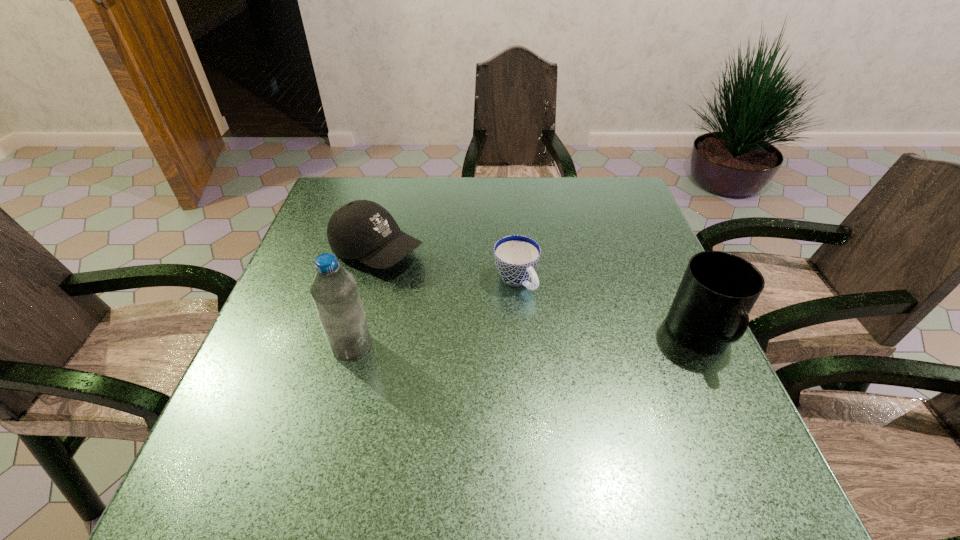
The height and width of the screenshot is (540, 960). I want to click on free location at the right edge, so click(x=671, y=281).

Identify the location of vacant space at the far right corner of the desktop. This screenshot has height=540, width=960. point(590,198).

Image resolution: width=960 pixels, height=540 pixels. I want to click on vacant region at the near right corner of the desktop, so click(x=735, y=421).

Where is `empty space that is in between the third shortest object and the third object from left to right`? Image resolution: width=960 pixels, height=540 pixels. empty space that is in between the third shortest object and the third object from left to right is located at coordinates (609, 308).

You are a GUI agent. You are given a task and a screenshot of the screen. Output one action in this format:
    pyautogui.click(x=<x>, y=<y>)
    Task: Click on the free spot between the third shortest object and the shortest object
    The image size is (960, 540).
    Given the screenshot: What is the action you would take?
    pyautogui.click(x=609, y=308)

The height and width of the screenshot is (540, 960). Identify the location of unoccupied position between the water bottle and the baseball cap. coord(365,299).

Image resolution: width=960 pixels, height=540 pixels. Find the location of `free spot between the tallest object and the shortest object`. free spot between the tallest object and the shortest object is located at coordinates (434, 313).

The height and width of the screenshot is (540, 960). I want to click on free point between the shortest object and the tallest object, so click(434, 313).

Find the location of a particular element. The image size is (960, 540). vacant area that lies between the cup and the mug is located at coordinates (609, 308).

Where is `free space between the shortest object and the mug`? free space between the shortest object and the mug is located at coordinates (609, 308).